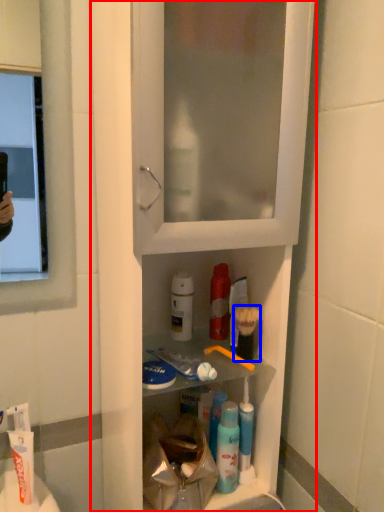
Question: Which point is closer to the camera, cabinetry (highlighted by a red box) or brush (highlighted by a blue box)?

Choices:
 (A) cabinetry
 (B) brush

Answer: (A)